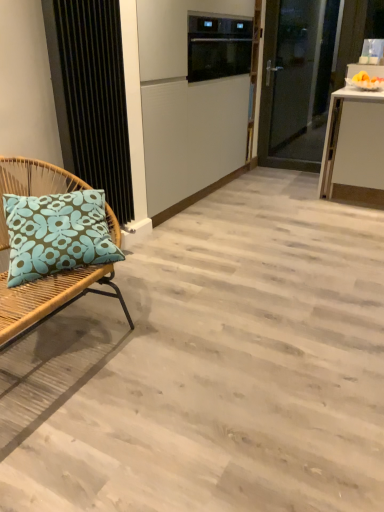
Question: Is point [309, 10] positioned closer to the camera than point [31, 166]?

Choices:
 (A) farther
 (B) closer

Answer: (A)

Question: Is transparent glass door at upper right wider or thinner than rattan cushion at left?

Choices:
 (A) wide
 (B) thin

Answer: (B)

Question: Which is farther from the black textured radiator at left?

Choices:
 (A) rattan cushion at left
 (B) black glass oven at upper center
 (C) transparent glass door at upper right

Answer: (C)

Question: Which is farther from the rattan cushion at left?

Choices:
 (A) black textured radiator at left
 (B) black glass oven at upper center
 (C) transparent glass door at upper right

Answer: (C)